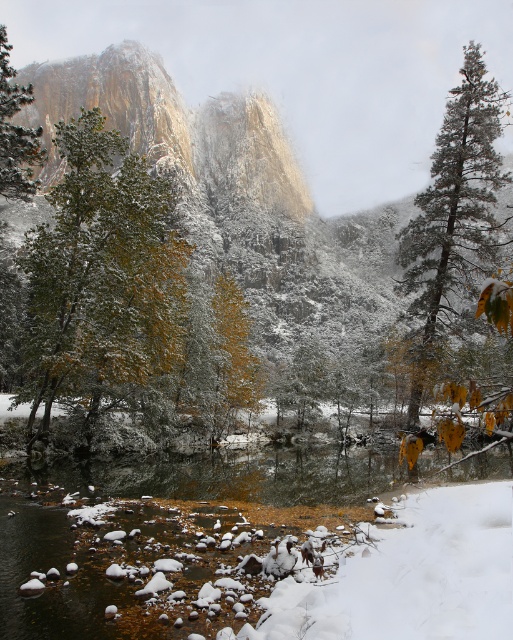
You are an observer standing in the valley looking at the green matte tree at center and the green textured pine tree at right. Which tree is closer to you?

The green matte tree at center is closer to you because the green textured pine tree at right is positioned behind it.

You are standing at the point of reference in the winter landscape scene. Where is the green matte tree at center located in relation to your position?

The green matte tree at center is located at the coordinates point (127, 307) in the scene.

You are standing in the winter landscape and want to take a photo of both the green textured pine tree at right and the green matte tree at left. Which tree should you adjust your camera angle upwards to include in the frame?

You should adjust your camera angle upwards to include the green textured pine tree at right because it is positioned above the green matte tree at left.